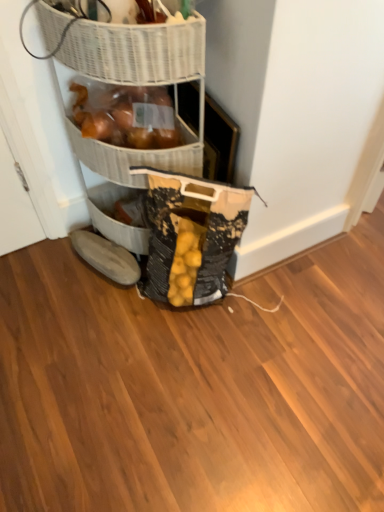
The height and width of the screenshot is (512, 384). I want to click on free space in front of brown suede boot at lower left, so click(x=96, y=313).